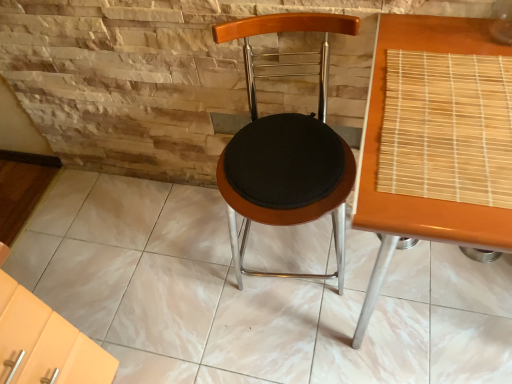
Find the location of a particular element. Image resolution: width=512 pixels, height=384 pixels. vacant space situated above bamboo mat at right (from a real-world perspective) is located at coordinates (460, 112).